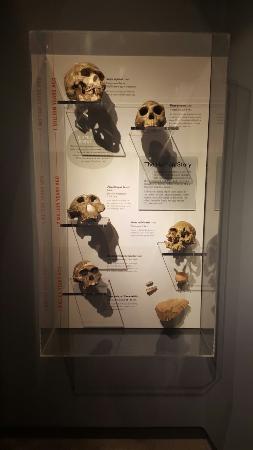
Where is `trim`? trim is located at coordinates (148, 432).